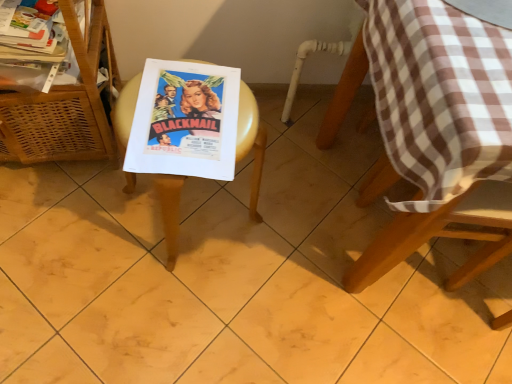
Question: Based on their positions, is brown checkered tablecloth at upper right located to the left or right of matte paper poster at center?

Choices:
 (A) right
 (B) left

Answer: (A)

Question: Considering the positions of brown checkered tablecloth at upper right and matte paper poster at center in the image, is brown checkered tablecloth at upper right taller or shorter than matte paper poster at center?

Choices:
 (A) tall
 (B) short

Answer: (B)

Question: Based on their relative distances, which object is farther from the brown checkered tablecloth at upper right?

Choices:
 (A) matte paper poster at center
 (B) white glossy magazine at upper left
 (C) woven wood basket at left
 (D) wooden picnic table at center

Answer: (C)

Question: Which of these objects is positioned closest to the woven wood basket at left?

Choices:
 (A) matte paper poster at center
 (B) white glossy magazine at upper left
 (C) wooden picnic table at center
 (D) brown checkered tablecloth at upper right

Answer: (B)